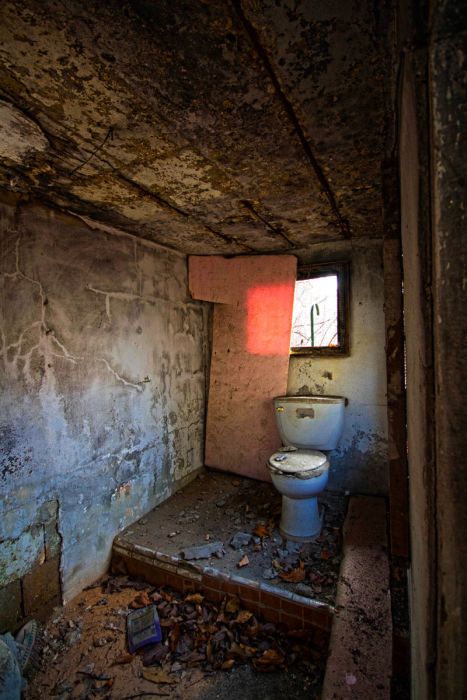
Find the location of `toilet bowl`. toilet bowl is located at coordinates (293, 486).